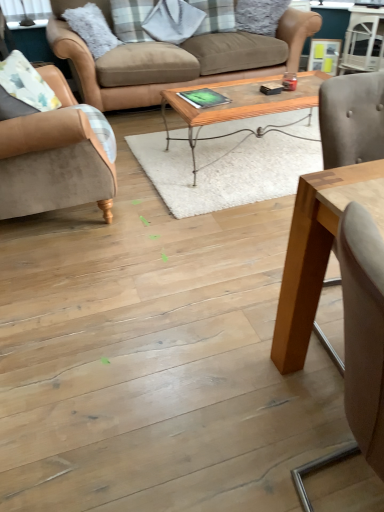
The width and height of the screenshot is (384, 512). What are the coordinates of `blank space situated above woodenwoodencoffee table at center, placed as the first coffee table when sorted from top to bottom (from a real-world perspective)` in the screenshot? It's located at (263, 92).